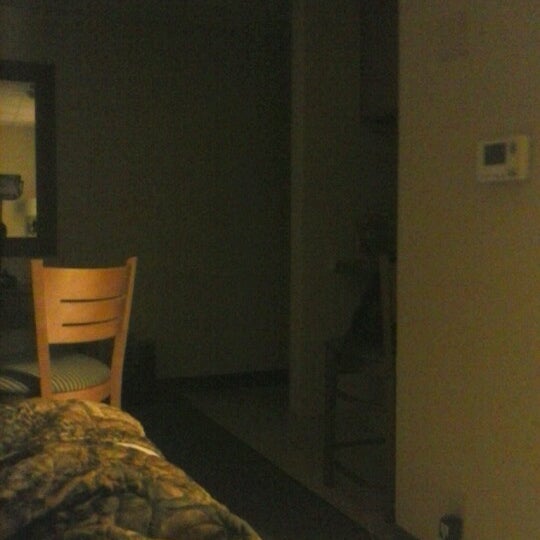
You are a GUI agent. You are given a task and a screenshot of the screen. Output one action in this format:
    pyautogui.click(x=<x>, y=<y>)
    Task: Click on the thermostat
    
    Given the screenshot: What is the action you would take?
    pyautogui.click(x=496, y=157), pyautogui.click(x=512, y=158)